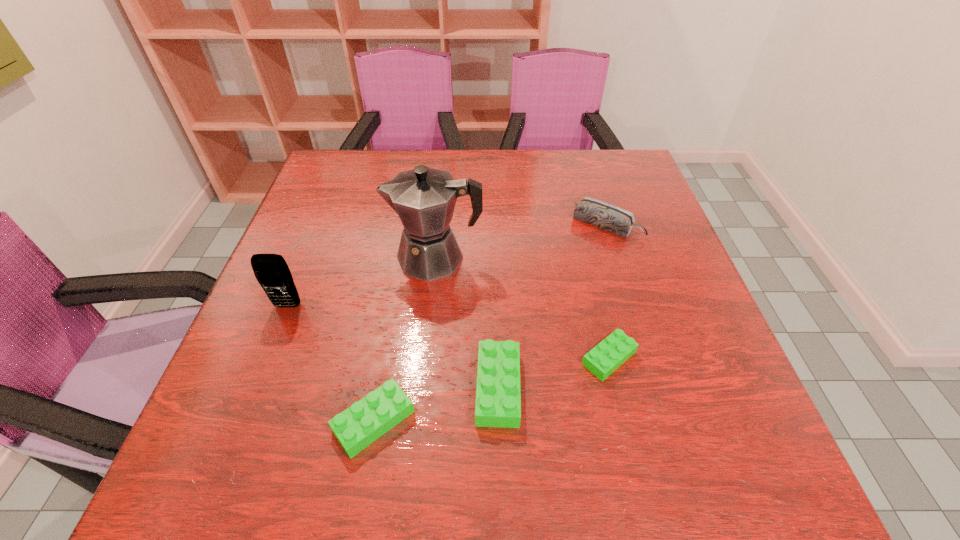
At what (x,y) coordinates should I click in order to perform the action: click on blank space that satisfies the following two spatial constraints: 1. at the spout of the shortest Lego; 2. on the left side of the tallest object. Please return your answer as a coordinate pair (x, y). Looking at the image, I should click on (425, 358).

Image resolution: width=960 pixels, height=540 pixels. Find the location of `vacant area that satisfies the following two spatial constraints: 1. on the back side of the tallest Lego; 2. at the spout of the coffeepot`. vacant area that satisfies the following two spatial constraints: 1. on the back side of the tallest Lego; 2. at the spout of the coffeepot is located at coordinates (493, 258).

What are the coordinates of `free space that satisfies the following two spatial constraints: 1. on the back side of the pencil box; 2. on the left side of the second tallest Lego` in the screenshot? It's located at (409, 225).

Find the location of a particular element. vacant region that satisfies the following two spatial constraints: 1. on the back side of the rightmost Lego; 2. on the right side of the pencil box is located at coordinates (577, 225).

Locate an element on the screen. This screenshot has height=540, width=960. free spot that satisfies the following two spatial constraints: 1. on the screen of the fifth shortest object; 2. on the left side of the second shortest Lego is located at coordinates (242, 421).